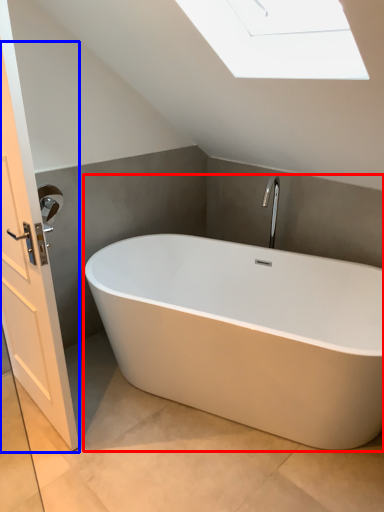
Question: Which of the following is the closest to the observer, bathtub (highlighted by a red box) or screen door (highlighted by a blue box)?

Choices:
 (A) bathtub
 (B) screen door

Answer: (B)